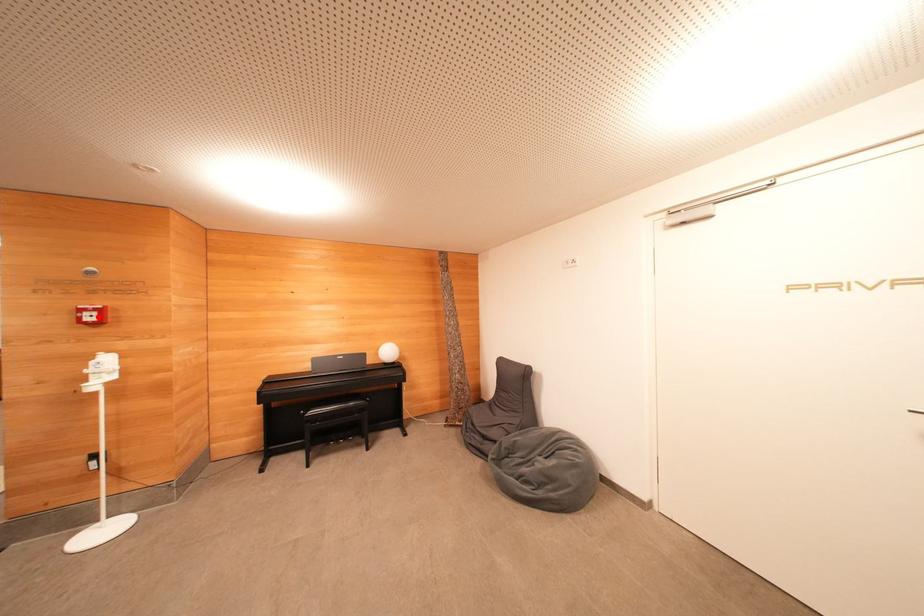
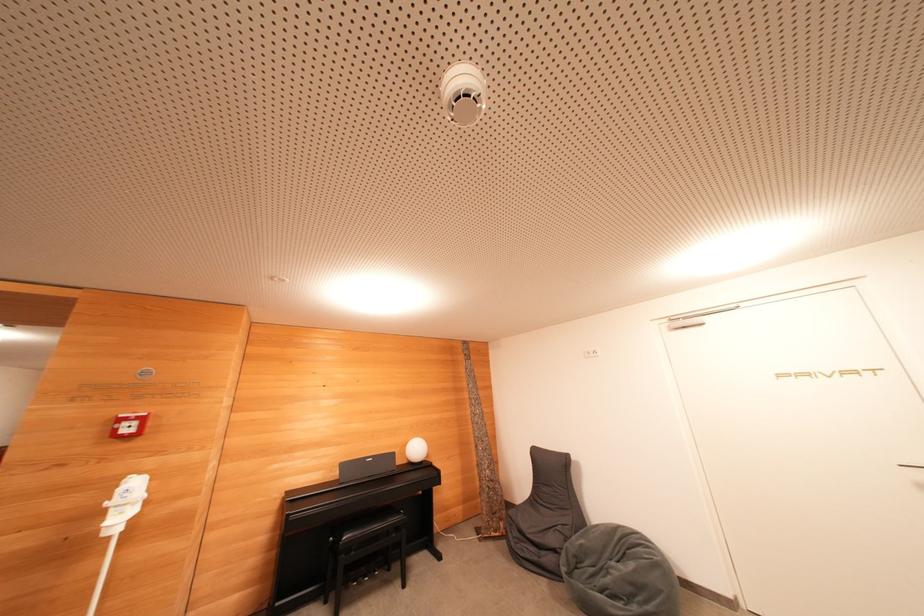
The point at the highlighted location is marked in the first image. Where is the corresponding point in the second image?

(139, 427)